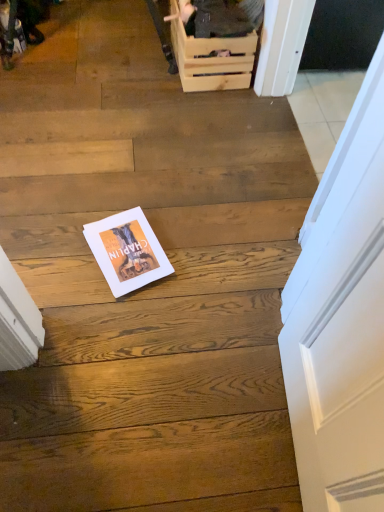
You are a GUI agent. You are given a task and a screenshot of the screen. Output one action in this format:
    pyautogui.click(x=<x>, y=<y>)
    Task: Click on the vacant location behind white paper magazine at center
    The image size is (384, 512).
    Given the screenshot: What is the action you would take?
    pyautogui.click(x=146, y=199)